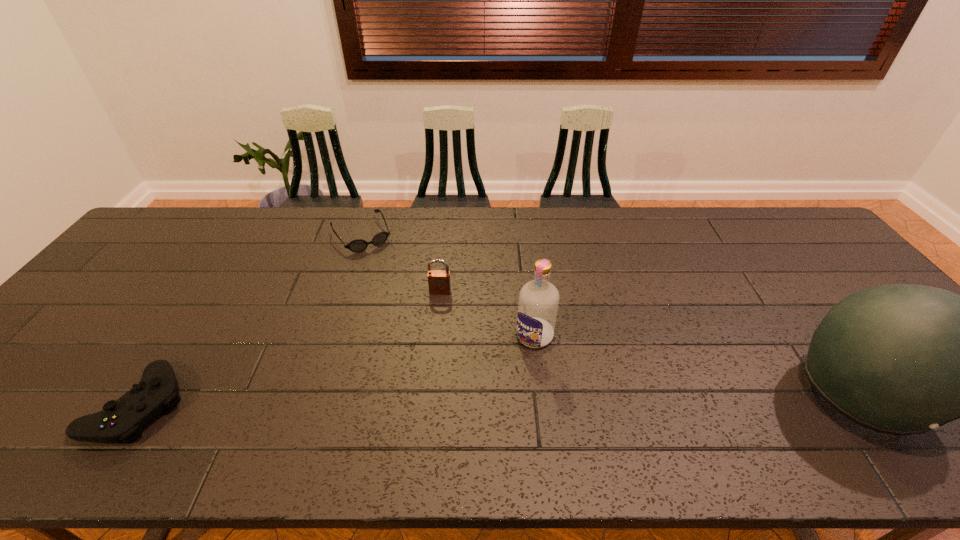
In the image, there is a desktop. At what (x,y) coordinates should I click in order to perform the action: click on free space at the far edge. Please return your answer as a coordinate pair (x, y). The width and height of the screenshot is (960, 540). Looking at the image, I should click on (222, 247).

Where is `free spot at the near edge of the desktop`? The width and height of the screenshot is (960, 540). free spot at the near edge of the desktop is located at coordinates (413, 398).

You are a GUI agent. You are given a task and a screenshot of the screen. Output one action in this format:
    pyautogui.click(x=<x>, y=<y>)
    Task: Click on the free space at the left edge of the desktop
    Image resolution: width=960 pixels, height=540 pixels.
    Given the screenshot: What is the action you would take?
    pyautogui.click(x=95, y=342)

I want to click on free space at the right edge, so pyautogui.click(x=823, y=256).

In the image, there is a desktop. Identify the location of free region at the far right corner. This screenshot has height=540, width=960. (771, 214).

Image resolution: width=960 pixels, height=540 pixels. Find the location of `vacant point located between the third object from left to right and the leftmost object`. vacant point located between the third object from left to right and the leftmost object is located at coordinates (290, 348).

This screenshot has height=540, width=960. I want to click on free space between the padlock and the leftmost object, so click(x=290, y=348).

The image size is (960, 540). I want to click on vacant space that's between the control and the padlock, so click(290, 348).

You are a GUI agent. You are given a task and a screenshot of the screen. Output one action in this format:
    pyautogui.click(x=<x>, y=<y>)
    Task: Click on the vacant space that's between the third shortest object and the fourth object from right to left
    The width and height of the screenshot is (960, 540).
    Given the screenshot: What is the action you would take?
    pyautogui.click(x=401, y=264)

I want to click on unoccupied area between the second object from left to right and the fourth tallest object, so click(x=251, y=320).